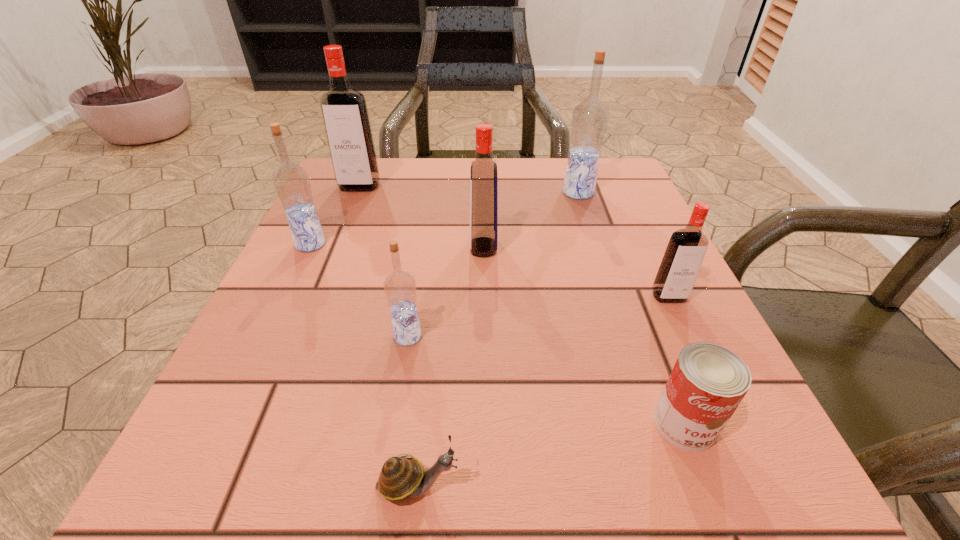
Find the location of a particular element. Image resolution: width=960 pixels, height=540 pixels. object at the far right corner is located at coordinates (589, 120).

You are a GUI agent. You are given a task and a screenshot of the screen. Output one action in this format:
    pyautogui.click(x=<x>, y=<y>)
    Task: Click on the object present at the near right corner
    
    Given the screenshot: What is the action you would take?
    pyautogui.click(x=708, y=382)

Where is `free space at the far edge of the desktop`? This screenshot has height=540, width=960. free space at the far edge of the desktop is located at coordinates (558, 195).

Where is `blank space at the left edge of the desktop`? The height and width of the screenshot is (540, 960). blank space at the left edge of the desktop is located at coordinates (316, 288).

In the image, there is a desktop. Identify the location of vacant area at the right edge. The height and width of the screenshot is (540, 960). (607, 235).

In the image, there is a desktop. Find the location of `vacant space at the near left corner`. vacant space at the near left corner is located at coordinates (202, 452).

The width and height of the screenshot is (960, 540). In order to click on free space at the far right corner of the desktop in this screenshot , I will do `click(571, 198)`.

Locate an element on the screen. The width and height of the screenshot is (960, 540). free point between the leftmost red vodka and the biggest blue vodka is located at coordinates (468, 189).

Identify the location of empty location between the leftmost red vodka and the second biggest red vodka. (421, 217).

What are the coordinates of `blank region between the third vodka from left to right and the second shortest object` in the screenshot? It's located at tap(546, 380).